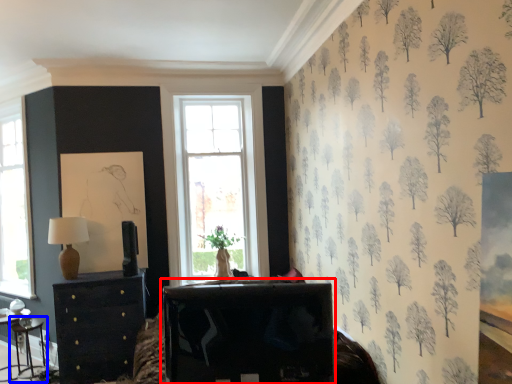
Question: Which object appears farthest to the camera in this image, table (highlighted by a red box) or table (highlighted by a blue box)?

Choices:
 (A) table
 (B) table

Answer: (B)